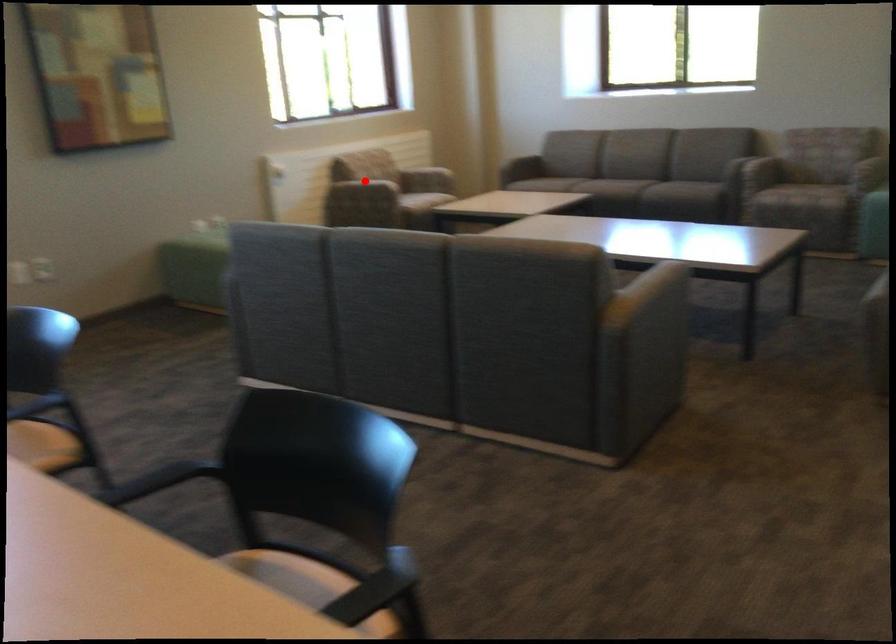
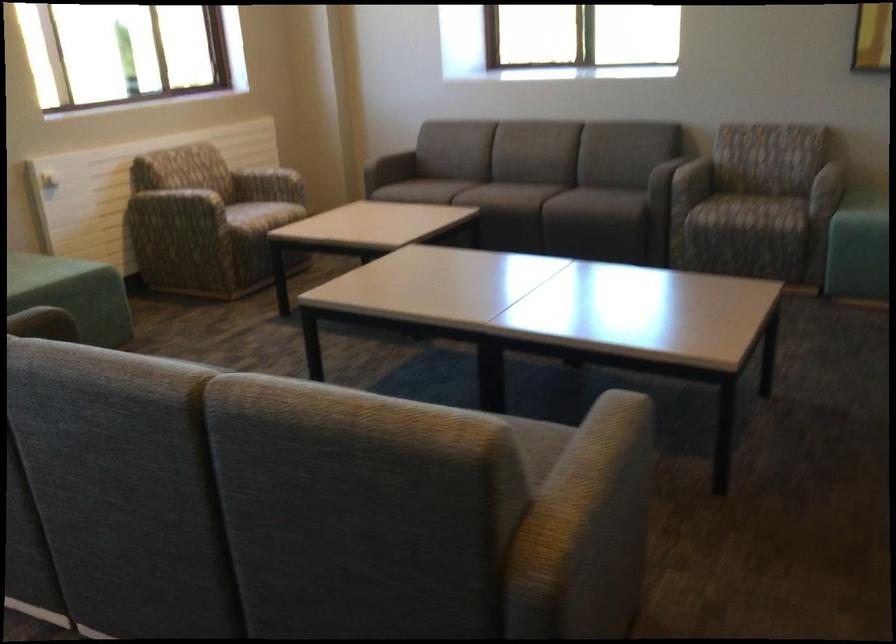
The point at the highlighted location is marked in the first image. Where is the corresponding point in the second image?

(179, 204)